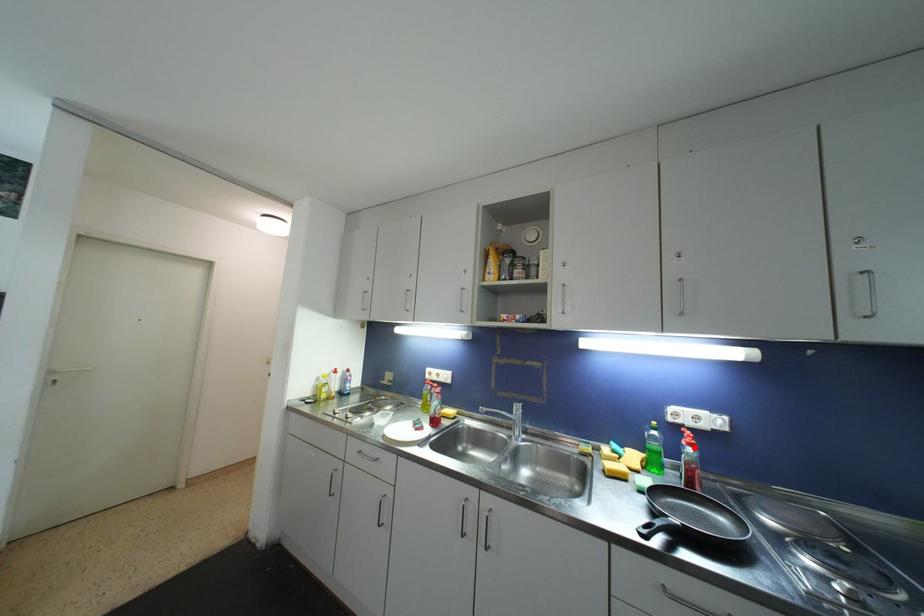
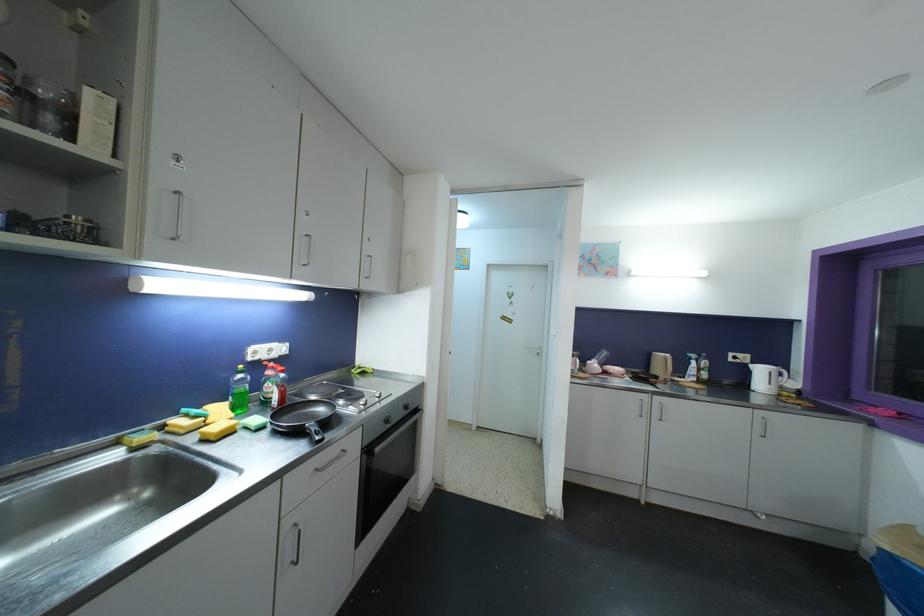
The point at the highlighted location is marked in the first image. Where is the corresponding point in the second image?

(286, 374)